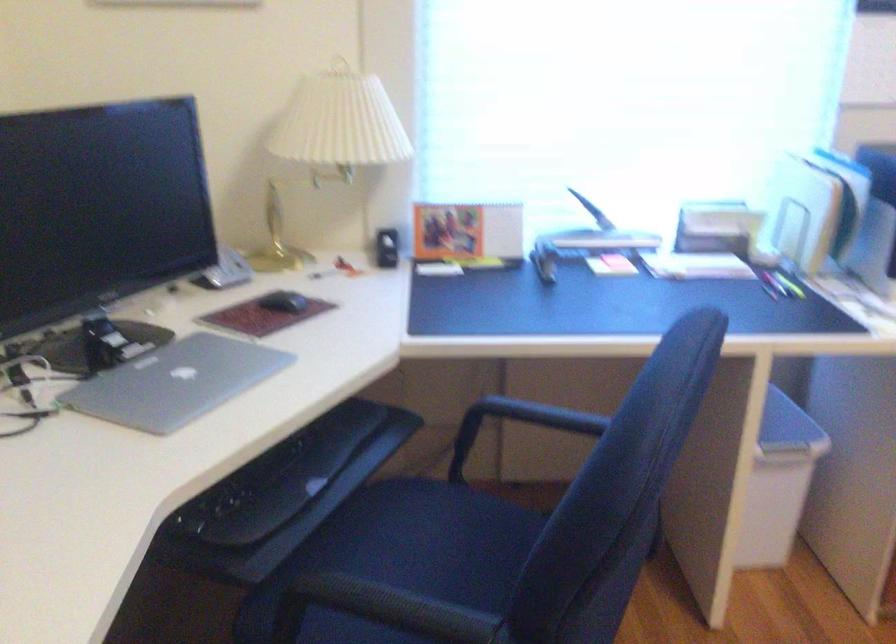
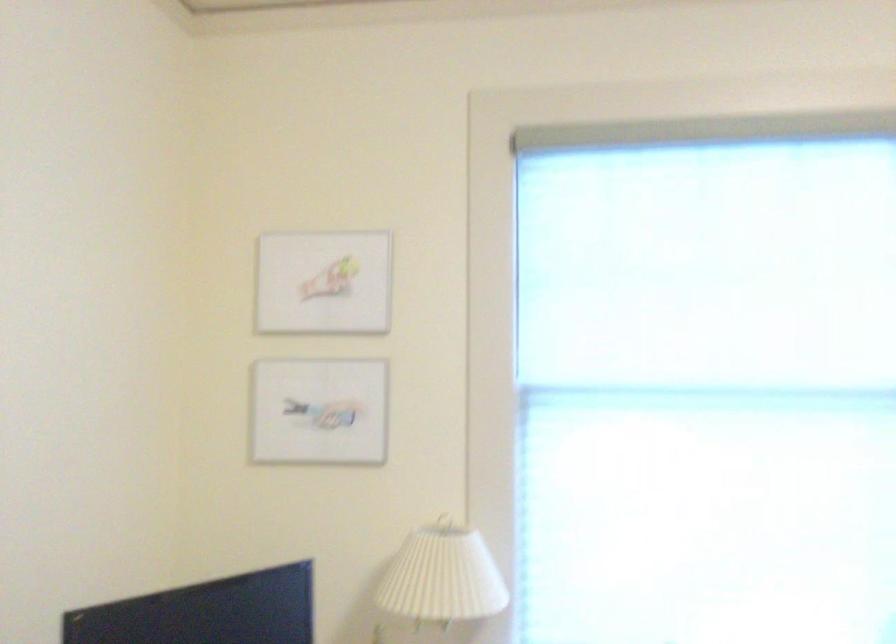
The images are taken continuously from a first-person perspective. In which direction are you moving?

The movement direction of the cameraman is right, backward.